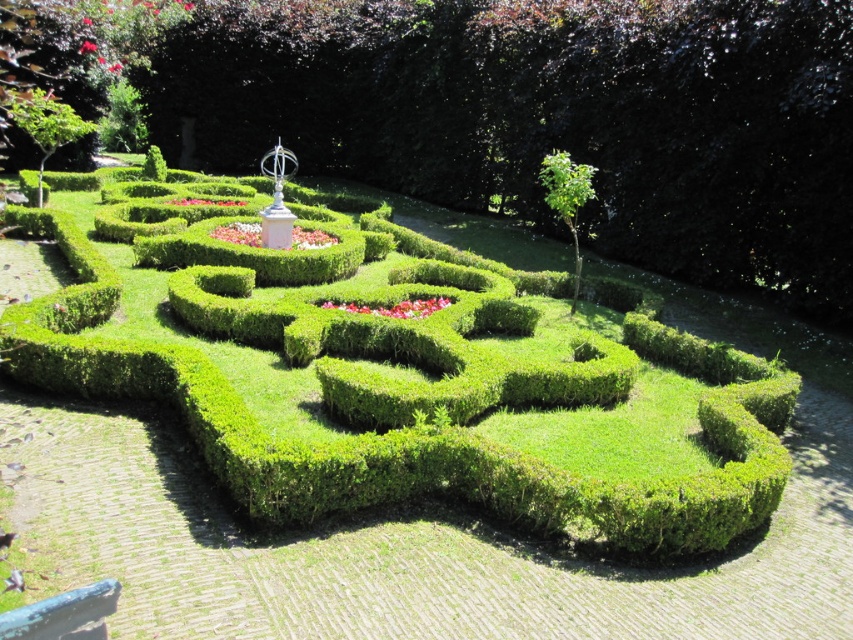
You are a gardener who needs to prune the green hedge maze at center and the green leafy bush at upper right. Which one will require a taller ladder to reach the top?

The green hedge maze at center requires a taller ladder because it has a greater height compared to the green leafy bush at upper right.

You are a drone operator who needs to capture aerial footage of the green hedge maze at center and the green leafy bush at upper right. Which object will appear larger in your camera view?

The green hedge maze at center will appear larger in the camera view because it is closer to the viewer than the green leafy bush at upper right.